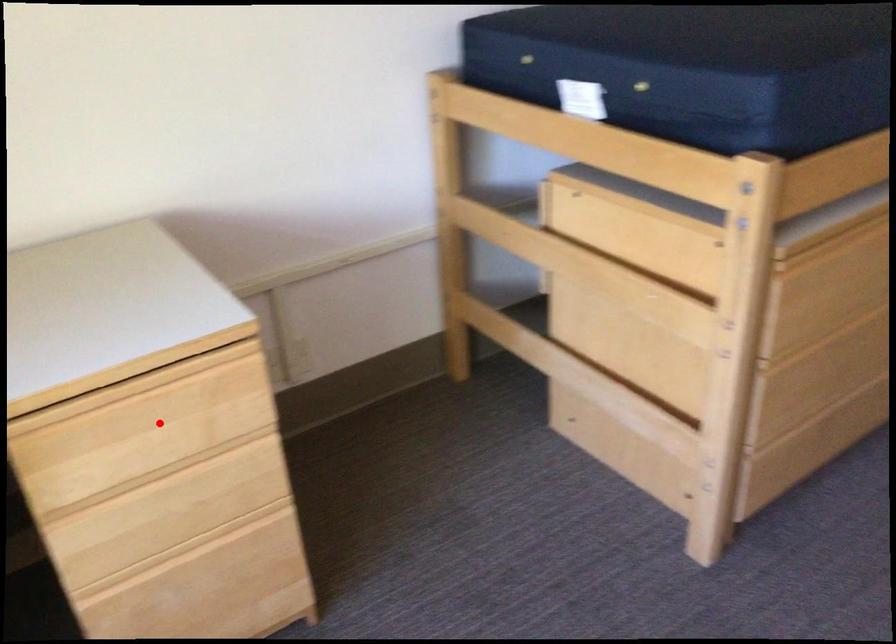
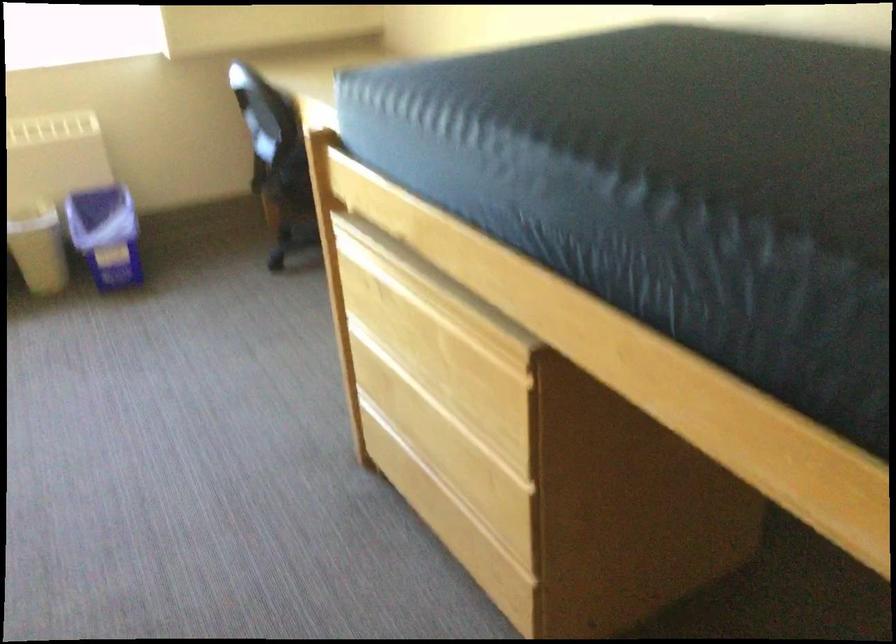
Question: I am providing you with two images of the same scene from different viewpoints. A red point is marked on the first image. Is the red point's position out of view in image 2?

Choices:
 (A) Yes
 (B) No

Answer: (A)